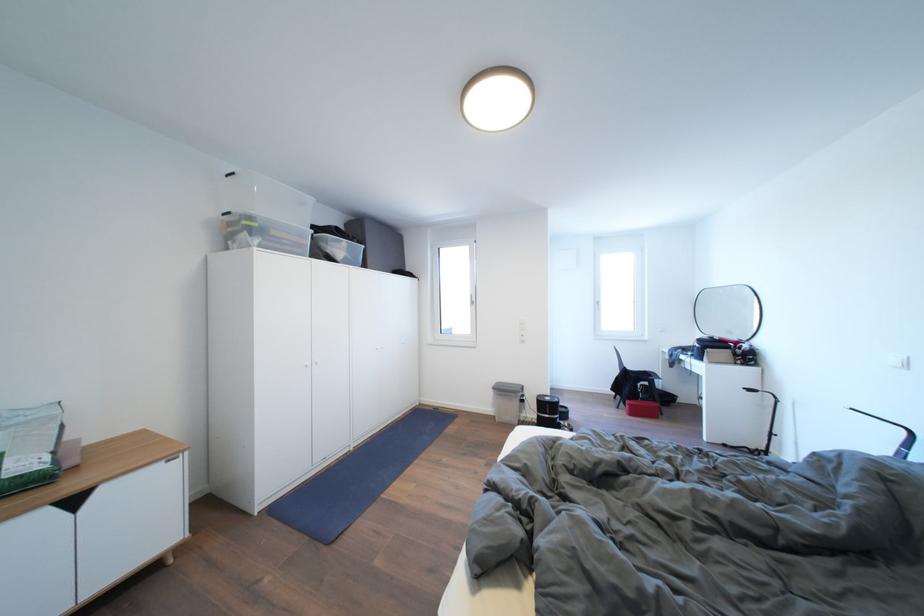
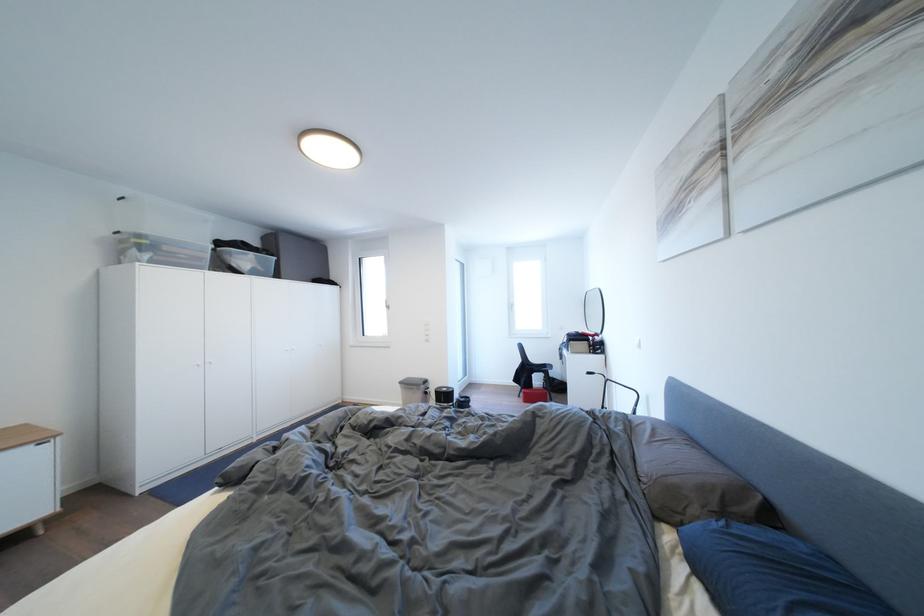
Find the pixel in the second image that matches pixel 258 223 in the first image.

(149, 241)